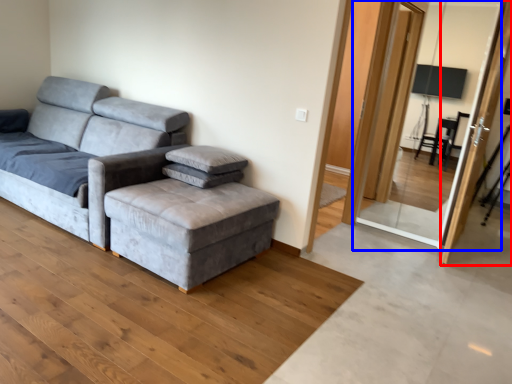
Question: Which point is closer to the camera, screen door (highlighted by a red box) or screen door (highlighted by a blue box)?

Choices:
 (A) screen door
 (B) screen door

Answer: (A)